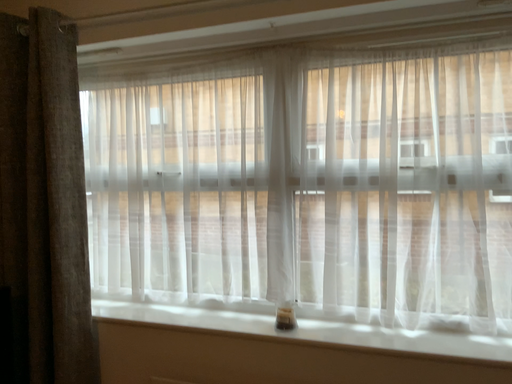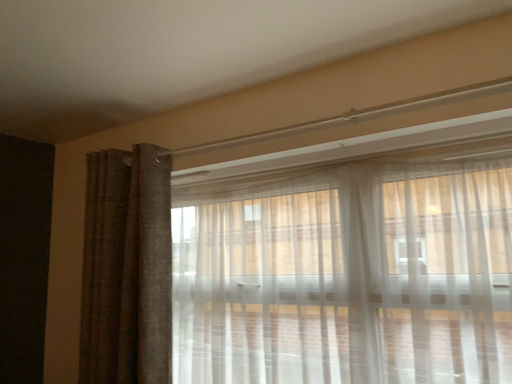
Question: How did the camera likely rotate when shooting the video?

Choices:
 (A) rotated right
 (B) rotated left

Answer: (B)